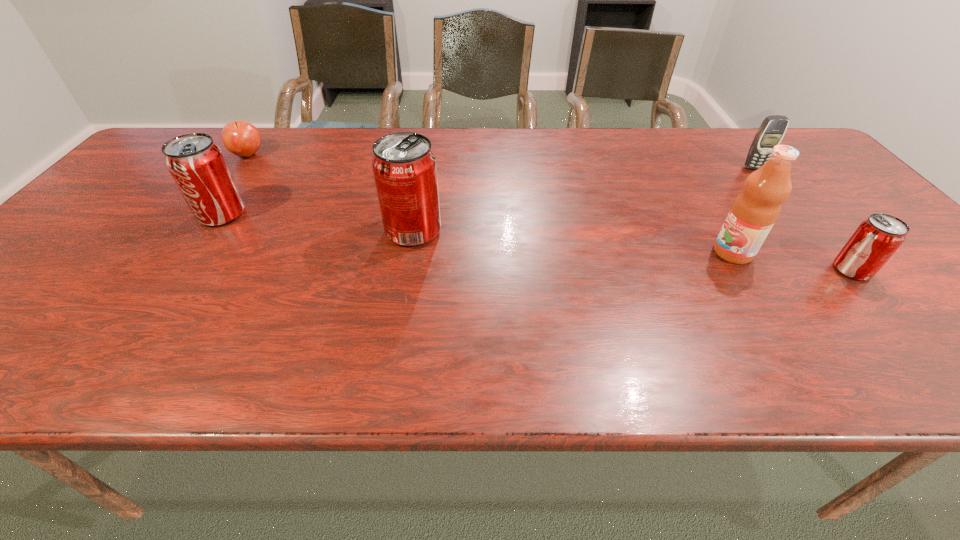
Locate an element on the screen. vacant position in the image that satisfies the following two spatial constraints: 1. on the front face of the fifth nearest object; 2. on the front label of the fruit juice is located at coordinates (824, 253).